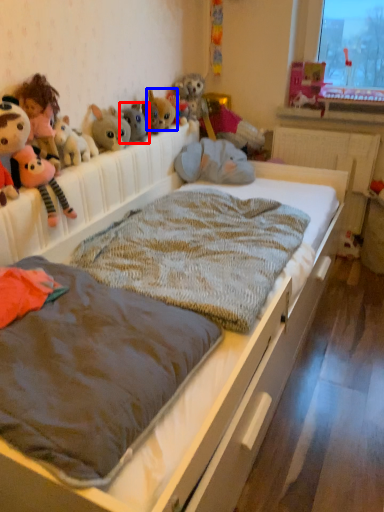
Question: Among these objects, which one is nearest to the camera, toy (highlighted by a red box) or toy (highlighted by a blue box)?

Choices:
 (A) toy
 (B) toy

Answer: (A)